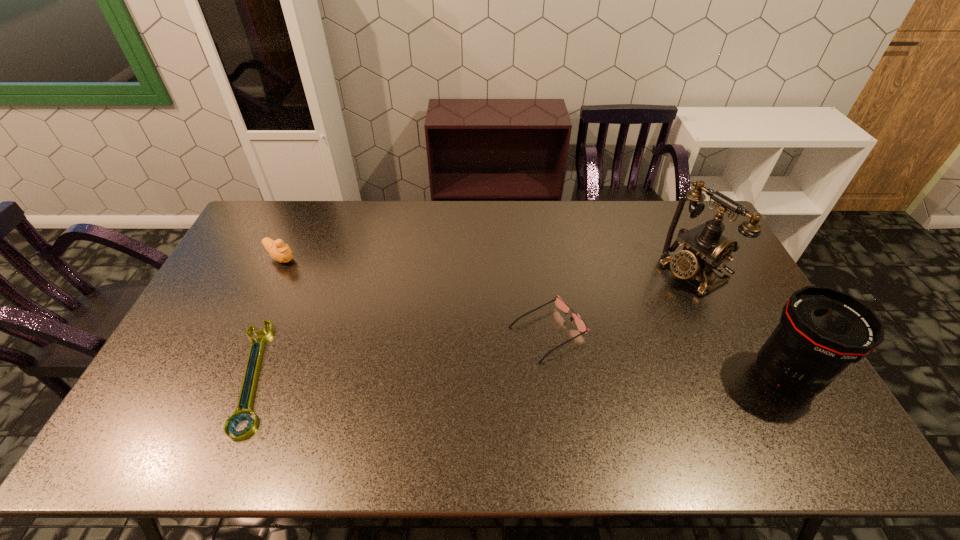
Locate an element on the screen. The image size is (960, 540). free space between the wrench and the tallest object is located at coordinates (472, 324).

Identify the location of vacant space that's between the wrench and the sunglasses. coord(400,354).

The width and height of the screenshot is (960, 540). What are the coordinates of `unoccupied area between the third object from left to right and the duckling` in the screenshot? It's located at (415, 295).

The height and width of the screenshot is (540, 960). In order to click on free spot between the sunglasses and the shortest object in this screenshot , I will do `click(400, 354)`.

At what (x,y) coordinates should I click in order to perform the action: click on free space between the telephone and the third shortest object. Please return your answer as a coordinate pair (x, y). Looking at the image, I should click on (487, 265).

Image resolution: width=960 pixels, height=540 pixels. Find the location of `vacant area that lies between the tallest object and the fourth shortest object`. vacant area that lies between the tallest object and the fourth shortest object is located at coordinates (738, 325).

Find the location of `unoccupied area between the shortest object and the third object from left to right`. unoccupied area between the shortest object and the third object from left to right is located at coordinates (400, 354).

This screenshot has height=540, width=960. Identify the location of free spot between the telephoto lens and the sunglasses. (666, 355).

The width and height of the screenshot is (960, 540). I want to click on the second closest object to the shortest object, so click(x=560, y=304).

Choose which object is the second nearest neighbor to the shortest object. Please provide its 2D coordinates. Your answer should be formatted as a tuple, i.e. [(x, y)], where the tuple contains the x and y coordinates of a point satisfying the conditions above.

[(560, 304)]